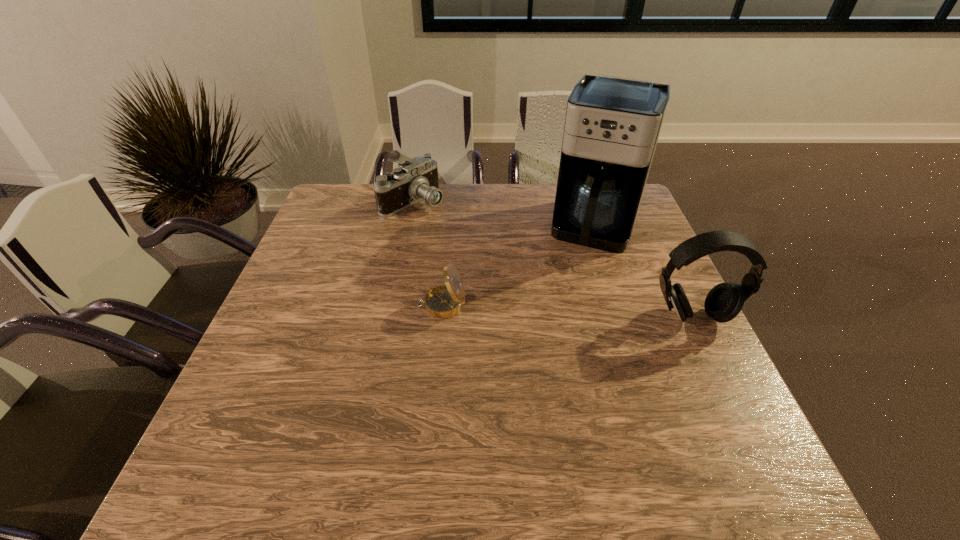
Image resolution: width=960 pixels, height=540 pixels. Identify the location of vacant space on the desktop that is between the compass and the earphone and is positioned at the lens of the camera. (549, 310).

Identify the location of free space on the desktop that is between the compass and the second tallest object and is positioned on the front panel of the coffee maker. (565, 311).